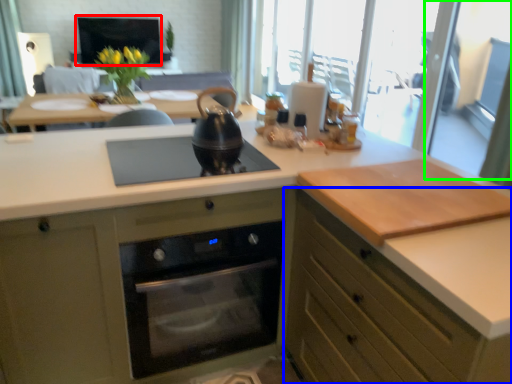
Question: Which object is positioned closest to window screen (highlighted by a red box)? Select from cabinetry (highlighted by a blue box) and screen door (highlighted by a green box).

Choices:
 (A) cabinetry
 (B) screen door

Answer: (B)